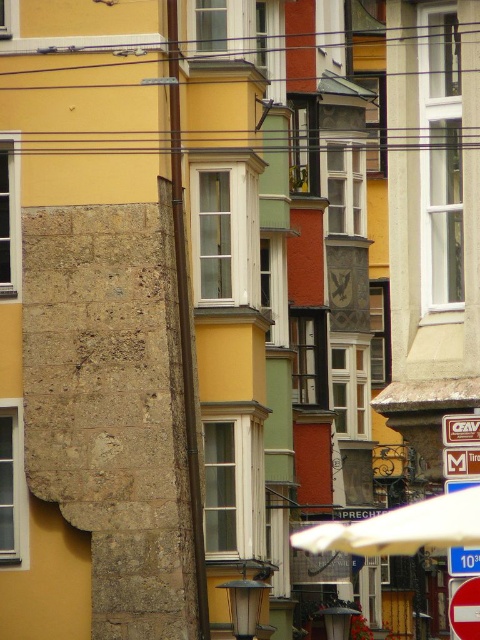
Which is in front, point (350, 554) or point (453, 458)?

Point (453, 458) is more forward.

Based on the photo, is white matte umbrella at center taller than metallic rectangular sign at center-right?

Yes, white matte umbrella at center is taller than metallic rectangular sign at center-right.

Between point (468, 522) and point (444, 464), which one is positioned behind?

The point (468, 522) is behind.

Find the location of a particular element. This screenshot has height=640, width=480. white matte umbrella at center is located at coordinates pos(400,529).

In the scene shown: Can you confirm if white matte umbrella at center is thinner than blue plastic sign at center?

No.

Is point (463, 532) farther from camera compared to point (471, 572)?

Yes, point (463, 532) is farther from viewer.

Identify the location of white matte umbrella at center. (400, 529).

Between metallic rectangular sign at center and metallic rectangular sign at center-right, which one appears on the right side from the viewer's perspective?

metallic rectangular sign at center

Is point (474, 440) more distant than point (467, 454)?

No.

What do you see at coordinates (460, 429) in the screenshot? I see `metallic rectangular sign at center` at bounding box center [460, 429].

Where is `metallic rectangular sign at center`? The height and width of the screenshot is (640, 480). metallic rectangular sign at center is located at coordinates (460, 429).